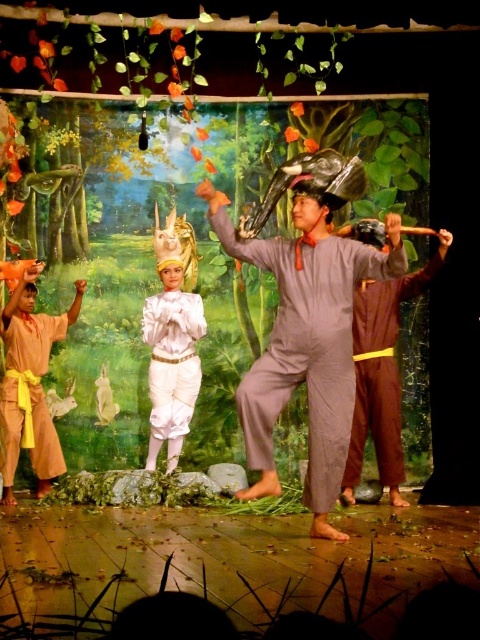
You are a stagehand observing the performers on stage. You notice the brown cotton pants at center and the white satin costume at center. Which one is closer to the floor?

The brown cotton pants at center is positioned under the white satin costume at center, so it is closer to the floor.

You are a stagehand responsible for adjusting the lighting. You need to move a spotlight from the matte brown robe at left to the white satin costume at center. Considering the distance between them is 3.78 feet, will you need to adjust the spotlight more than 4 feet to cover the entire distance?

The distance between the matte brown robe at left and the white satin costume at center is 3.78 feet. Since 3.78 feet is less than 4 feet, the spotlight adjustment needed is less than 4 feet to cover the entire distance.

You are a photographer capturing the stage from the audience perspective. You notice two points on the stage marked as point (x=360, y=428) and point (x=165, y=413). Which point will appear larger in your photo?

Point (x=360, y=428) is closer to the camera than point (x=165, y=413), so it will appear larger in the photo.